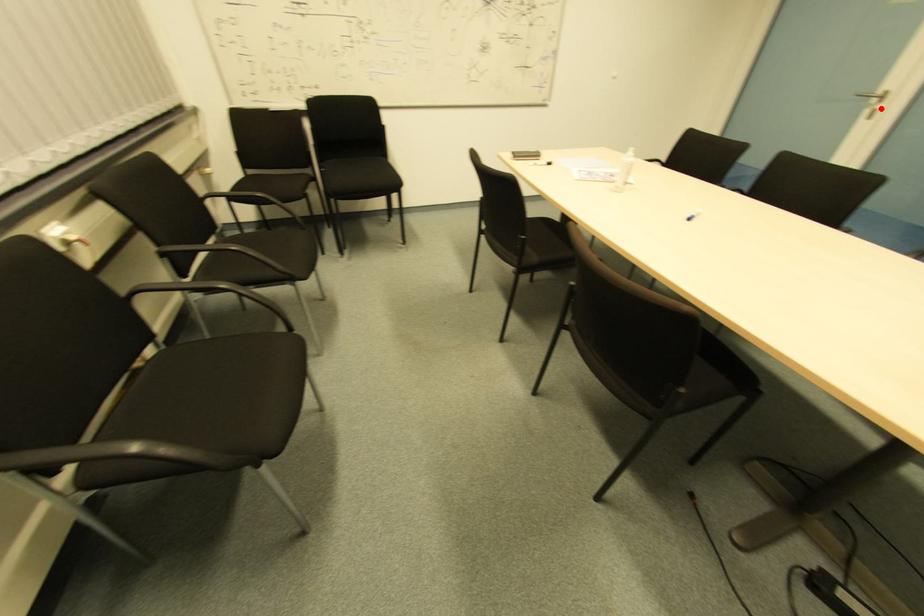
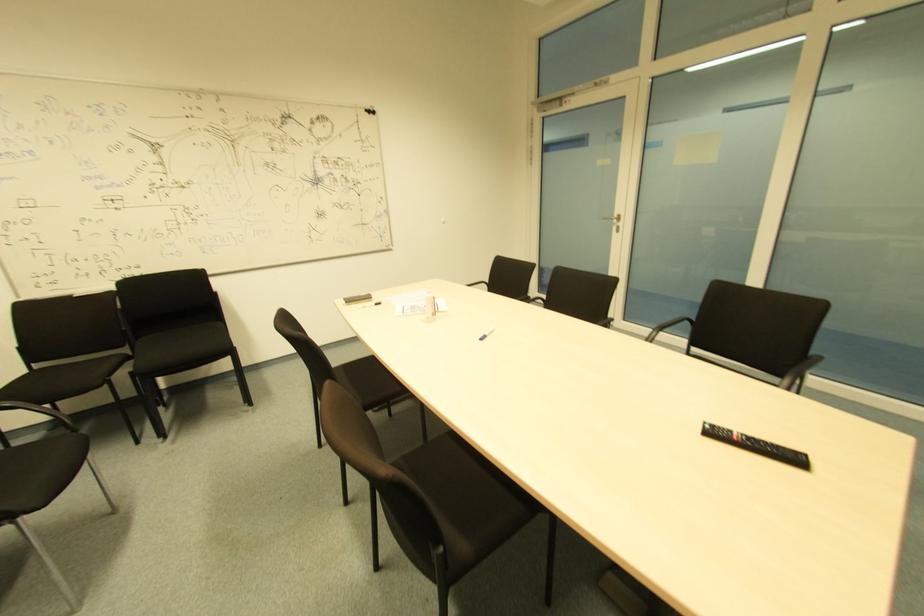
The point at the highlighted location is marked in the first image. Where is the corresponding point in the second image?

(618, 227)